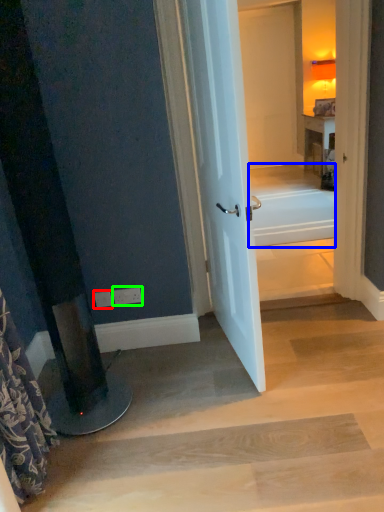
Question: Which object is positioned closest to electric outlet (highlighted by a red box)? Select from bath (highlighted by a blue box) and electric outlet (highlighted by a green box).

Choices:
 (A) bath
 (B) electric outlet

Answer: (B)